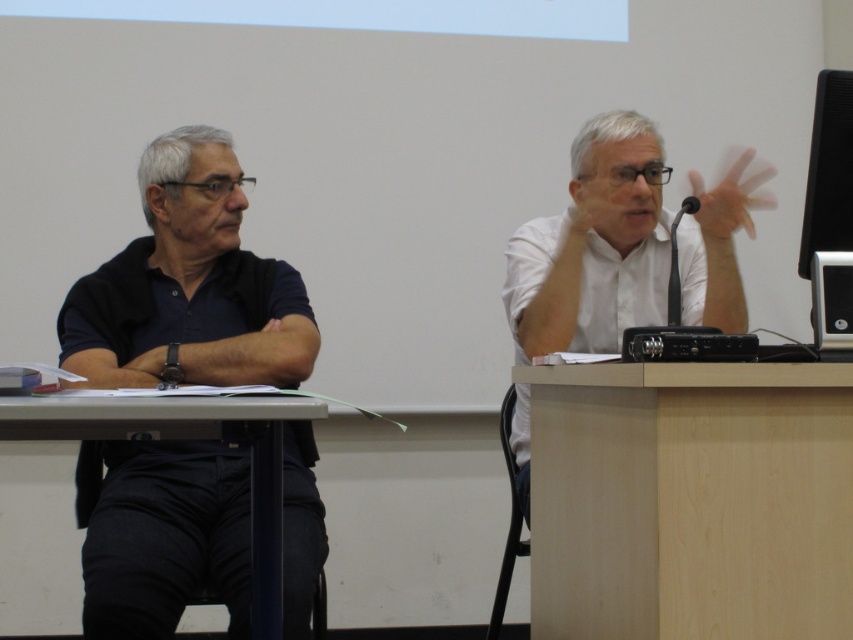
Question: Which point appears farthest from the camera in this image?

Choices:
 (A) (219, 432)
 (B) (743, 358)
 (C) (538, 340)

Answer: (C)

Question: Considering the relative positions of gray plastic table at lower left and white matte hand at upper right in the image provided, where is gray plastic table at lower left located with respect to white matte hand at upper right?

Choices:
 (A) below
 (B) above

Answer: (A)

Question: Is gray plastic table at lower left below black plastic projector at center?

Choices:
 (A) no
 (B) yes

Answer: (B)

Question: Which point is closer to the camera taking this photo?

Choices:
 (A) (802, 600)
 (B) (665, 348)

Answer: (B)

Question: Which point is closer to the camera?

Choices:
 (A) (729, 224)
 (B) (248, 420)

Answer: (B)

Question: Does dark blue shirt at left have a larger size compared to black glossy monitor at upper right?

Choices:
 (A) yes
 (B) no

Answer: (A)